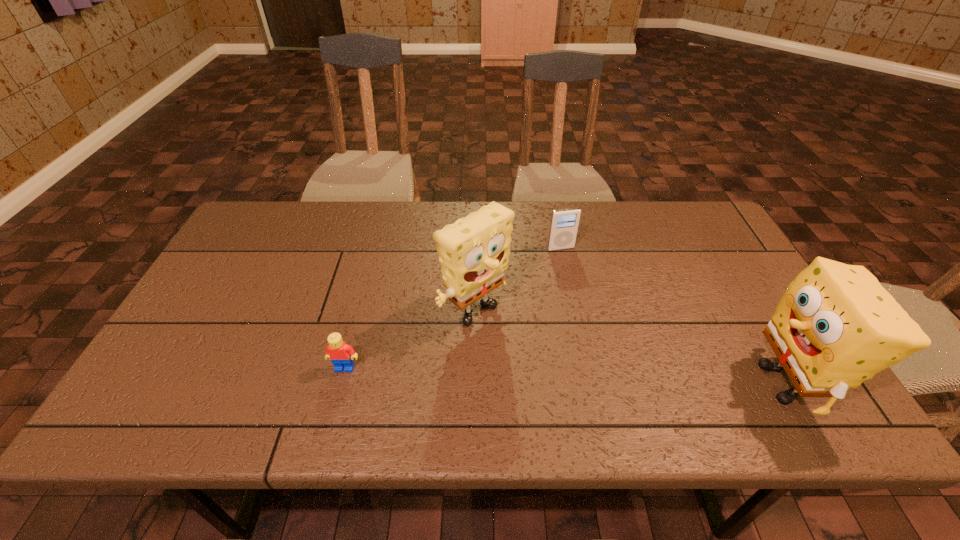
I want to click on free space that satisfies the following two spatial constraints: 1. on the face of the right sponge; 2. on the face of the shortest object, so pyautogui.click(x=341, y=383).

Locate an element on the screen. Image resolution: width=960 pixels, height=540 pixels. free region that satisfies the following two spatial constraints: 1. on the face of the rightmost object; 2. on the face of the shortest object is located at coordinates (341, 383).